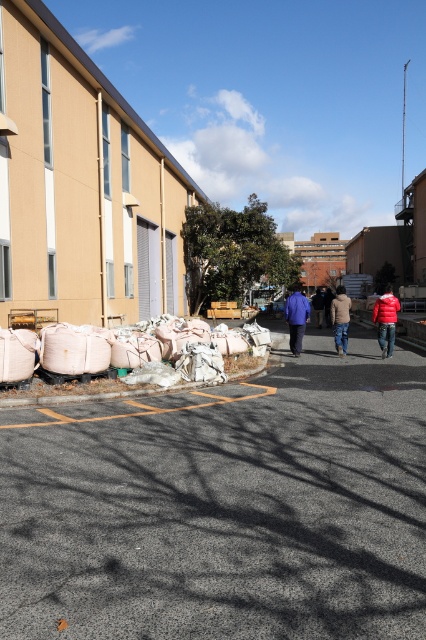
Which of these two, gray asphalt pavement at lower center or dark blue jacket at center, stands shorter?

gray asphalt pavement at lower center

Is point (371, 600) positioned in front of point (311, 301)?

Yes, point (371, 600) is in front of point (311, 301).

In order to click on gray asphalt pavement at lower center in this screenshot , I will do `click(224, 508)`.

Where is `beige wool sweater at center`? Image resolution: width=426 pixels, height=640 pixels. beige wool sweater at center is located at coordinates (340, 317).

Looking at this image, is beige wool sweater at center below dark blue jacket at center?

Yes.

Does point (345, 316) lie behind point (319, 310)?

No, it is in front of (319, 310).

Identify the location of beige wool sweater at center. The height and width of the screenshot is (640, 426). (340, 317).

Is white fabric sacks at lower left above matte blue jacket at center?

No.

Is white fabric sacks at lower left taller than matte blue jacket at center?

In fact, white fabric sacks at lower left may be shorter than matte blue jacket at center.

You are a GUI agent. You are given a task and a screenshot of the screen. Output one action in this format:
    pyautogui.click(x=<x>, y=<y>)
    Task: Click on the white fabric sacks at lower left
    This screenshot has height=640, width=426.
    Given the screenshot: What is the action you would take?
    pyautogui.click(x=138, y=348)